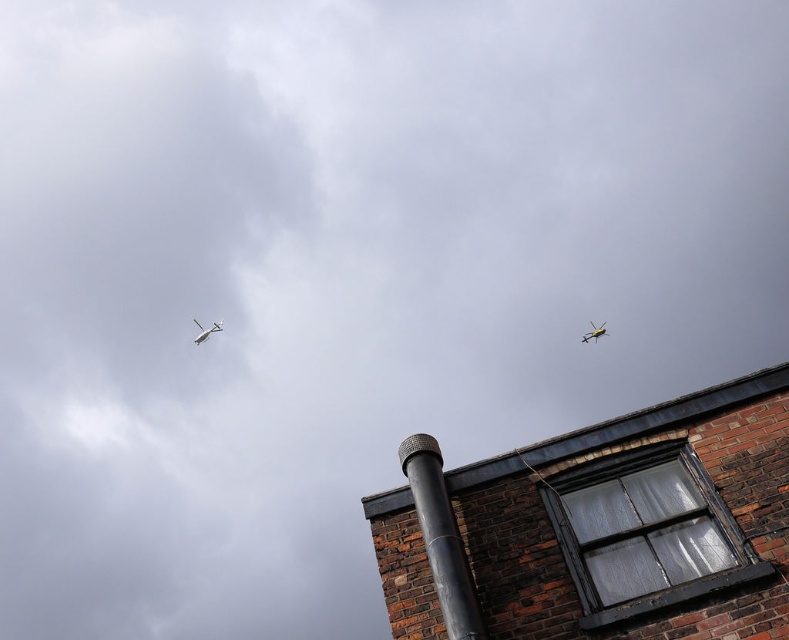
Question: Is smooth brick chimney at upper right thinner than metallic yellow airplane at upper right?

Choices:
 (A) no
 (B) yes

Answer: (A)

Question: Among these objects, which one is nearest to the camera?

Choices:
 (A) smooth brick chimney at upper right
 (B) white glossy airplane at upper left

Answer: (A)

Question: Is smooth brick chimney at upper right wider than metallic yellow airplane at upper right?

Choices:
 (A) yes
 (B) no

Answer: (A)

Question: Does smooth brick chimney at upper right have a lesser width compared to metallic yellow airplane at upper right?

Choices:
 (A) no
 (B) yes

Answer: (A)

Question: Estimate the real-world distances between objects in this image. Which object is farther from the metallic yellow airplane at upper right?

Choices:
 (A) smooth brick chimney at upper right
 (B) white glossy airplane at upper left

Answer: (A)

Question: Which point is farther to the camera?

Choices:
 (A) (199, 336)
 (B) (780, 547)

Answer: (A)